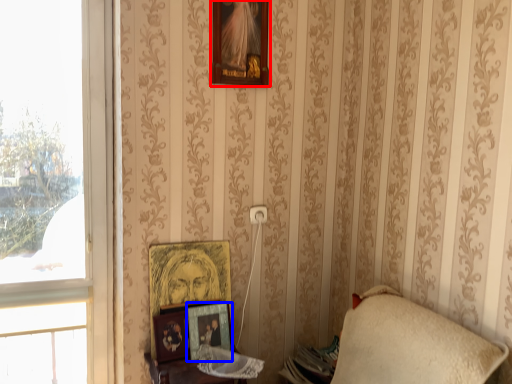
Question: Among these objects, which one is nearest to the camera, picture frame (highlighted by a red box) or picture frame (highlighted by a blue box)?

Choices:
 (A) picture frame
 (B) picture frame

Answer: (A)